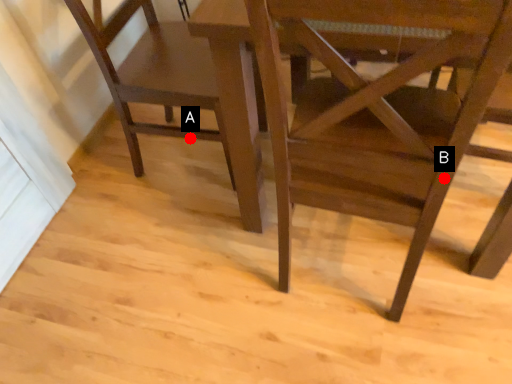
Question: Two points are circled on the image, labeled by A and B beside each circle. Among these points, which one is farthest from the camera?

Choices:
 (A) A is further
 (B) B is further

Answer: (A)